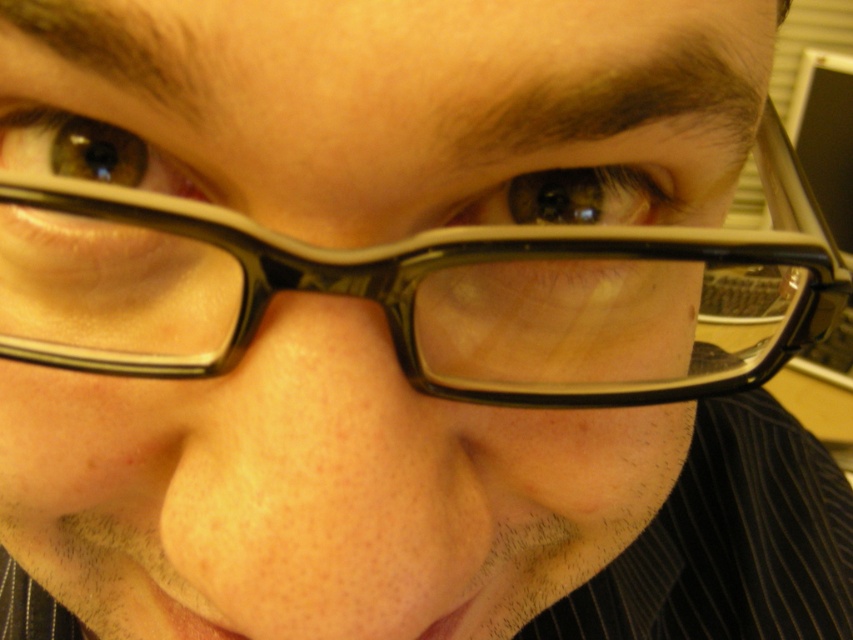
You are a photographer adjusting the lighting in a studio. You notice two matte black eyes in the frame. The matte black eye at center and the matte black eye at upper left. Which one appears larger in height?

The matte black eye at center appears much taller than the matte black eye at upper left, so it is larger in height.

You are a photographer adjusting your camera settings to capture a close portrait. You notice the black plastic glasses at center and the matte black eye at upper left in your viewfinder. Which object is positioned lower in the frame?

The black plastic glasses at center is positioned below the matte black eye at upper left, so the black plastic glasses at center is lower in the frame.